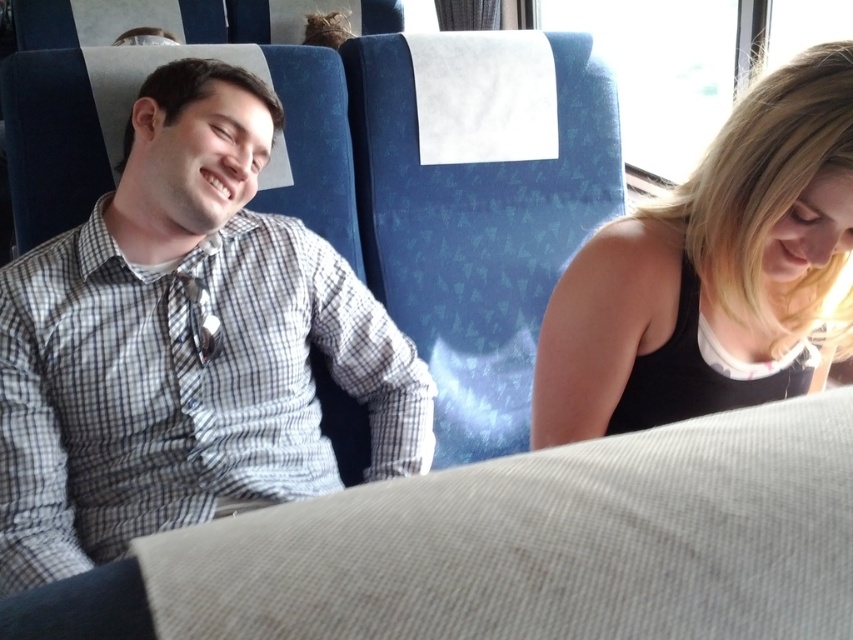
Between checkered fabric shirt at left and black tank top at right, which one is positioned higher?

checkered fabric shirt at left is higher up.

Is point (128, 381) more distant than point (753, 188)?

That is True.

At what (x,y) coordinates should I click in order to perform the action: click on checkered fabric shirt at left. Please return your answer as a coordinate pair (x, y). Looking at the image, I should click on (184, 344).